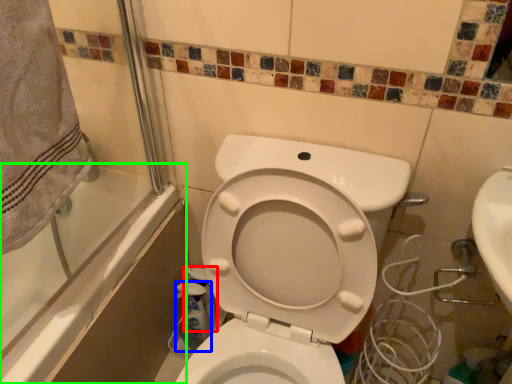
Question: Which object is positioned farthest from cleaning product (highlighted by a red box)? Select from cleaning product (highlighted by a blue box) and bath (highlighted by a green box).

Choices:
 (A) cleaning product
 (B) bath

Answer: (B)